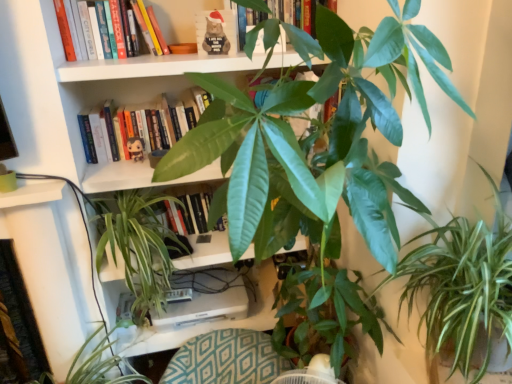
Question: Is matte black plush toy at upper center positioned with its back to green leafy plant at lower right?

Choices:
 (A) yes
 (B) no

Answer: (B)

Question: Is matte black plush toy at upper center far from green leafy plant at lower right?

Choices:
 (A) no
 (B) yes

Answer: (B)

Question: Could you tell me if matte black plush toy at upper center is facing green leafy plant at lower right?

Choices:
 (A) no
 (B) yes

Answer: (A)

Question: Considering the relative positions of matte black plush toy at upper center and green leafy plant at lower right in the image provided, is matte black plush toy at upper center to the left of green leafy plant at lower right from the viewer's perspective?

Choices:
 (A) no
 (B) yes

Answer: (B)

Question: Does matte black plush toy at upper center have a lesser width compared to green leafy plant at lower right?

Choices:
 (A) no
 (B) yes

Answer: (B)

Question: Do you think green glossy leafy plant at center, the first houseplant positioned from the right, is within green leafy plant at lower left, the 1th houseplant from the left, or outside of it?

Choices:
 (A) outside
 (B) inside

Answer: (A)

Question: Considering the positions of point (510, 329) and point (136, 377), is point (510, 329) closer or farther from the camera than point (136, 377)?

Choices:
 (A) closer
 (B) farther

Answer: (A)

Question: From a real-world perspective, is green glossy leafy plant at center, the first houseplant positioned from the right, positioned above or below green leafy plant at lower left, the 1th houseplant from the left?

Choices:
 (A) below
 (B) above

Answer: (B)

Question: Looking at their shapes, would you say green glossy leafy plant at center, which is the third houseplant in left-to-right order, is wider or thinner than green leafy plant at lower left, the third houseplant in the right-to-left sequence?

Choices:
 (A) thin
 (B) wide

Answer: (B)

Question: Looking at the image, does green matte book at upper center, which appears as the 3th book when viewed from the top, seem bigger or smaller compared to green glossy plant at center, the 2th houseplant in the right-to-left sequence?

Choices:
 (A) big
 (B) small

Answer: (B)

Question: Choose the correct answer: Is green matte book at upper center, which appears as the 3th book when viewed from the top, inside green glossy plant at center, the 2th houseplant in the right-to-left sequence, or outside it?

Choices:
 (A) outside
 (B) inside

Answer: (A)

Question: In the image, is green matte book at upper center, which appears as the 3th book when viewed from the top, positioned in front of or behind green glossy plant at center, which ranks as the second houseplant in left-to-right order?

Choices:
 (A) behind
 (B) front

Answer: (A)

Question: Looking at their shapes, would you say green matte book at upper center, the first book positioned from the bottom, is wider or thinner than green glossy plant at center, the 2th houseplant in the right-to-left sequence?

Choices:
 (A) thin
 (B) wide

Answer: (A)

Question: From a real-world perspective, is green glossy plant at center, the 2th houseplant in the right-to-left sequence, positioned above or below green leafy plant at lower left, the 1th houseplant from the left?

Choices:
 (A) above
 (B) below

Answer: (A)

Question: From the image's perspective, is green glossy plant at center, the 2th houseplant in the right-to-left sequence, positioned above or below green leafy plant at lower left, the 1th houseplant from the left?

Choices:
 (A) below
 (B) above

Answer: (B)